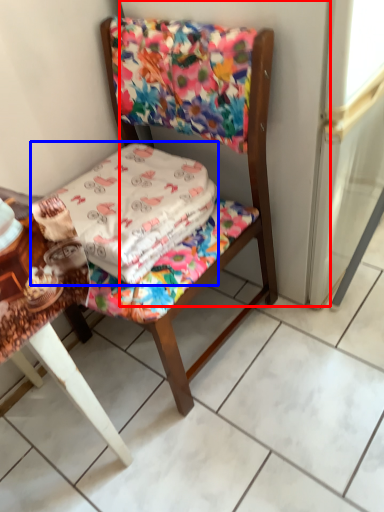
Question: Which object appears closest to the camera in this image, screen door (highlighted by a red box) or blanket (highlighted by a blue box)?

Choices:
 (A) screen door
 (B) blanket

Answer: (A)